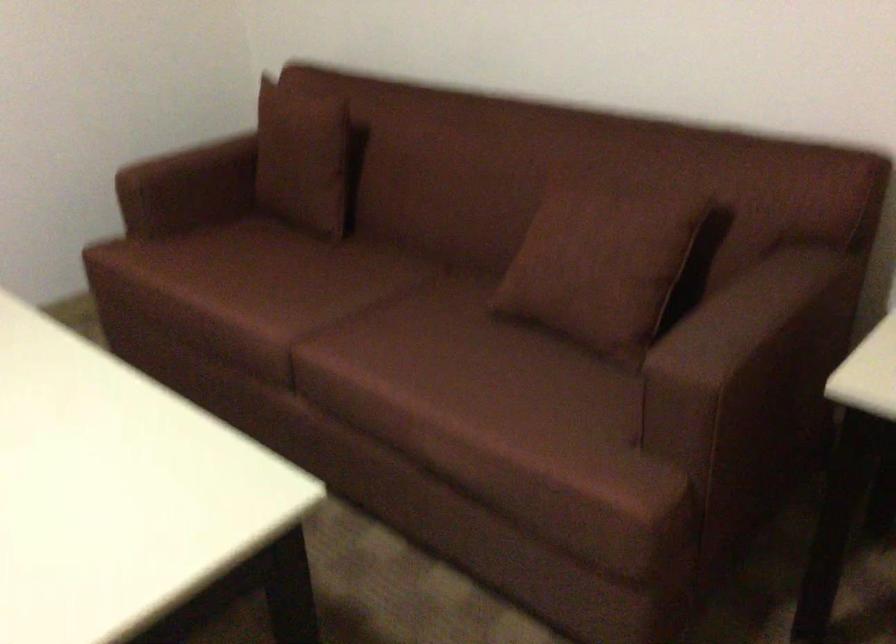
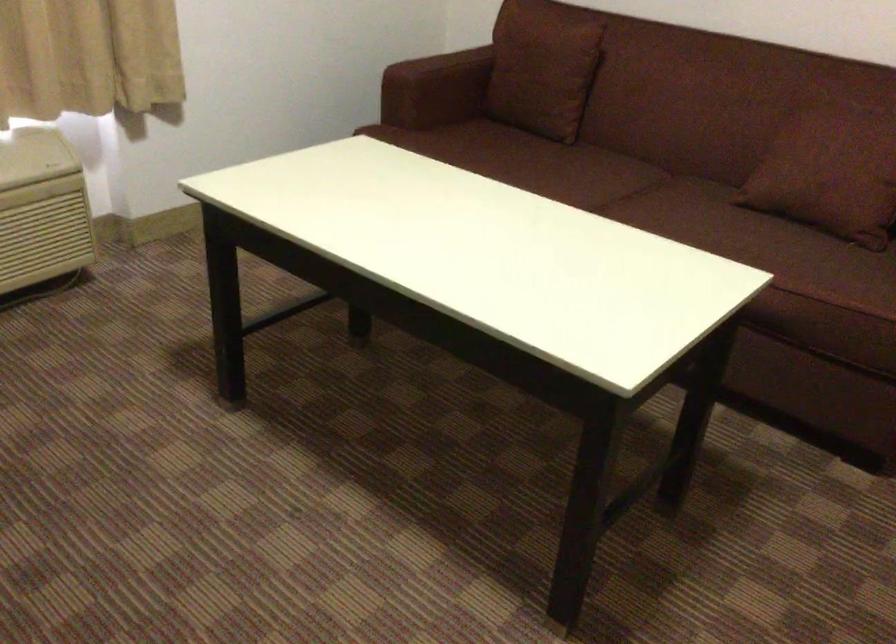
Where in the second image is the point corresponding to (x=188, y=163) from the first image?

(441, 66)